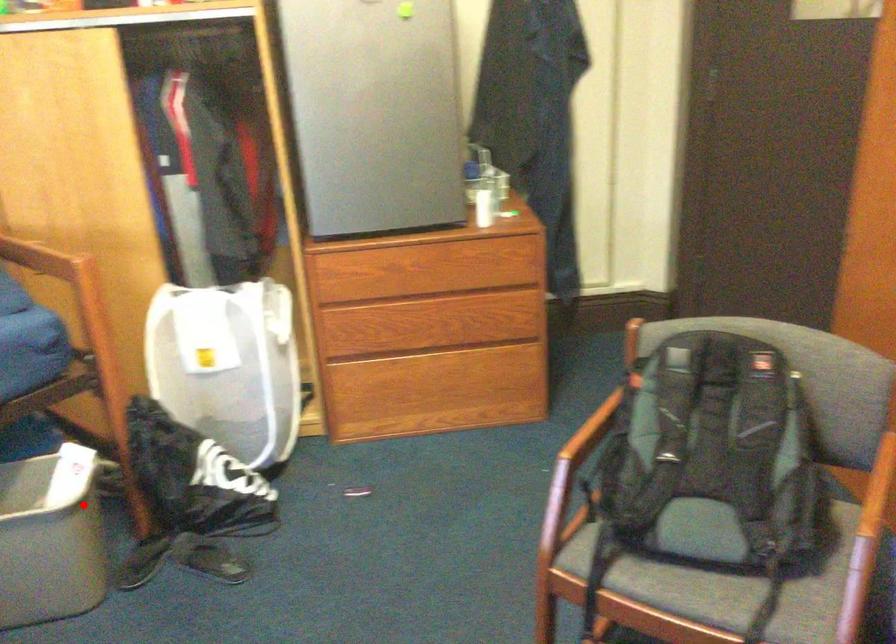
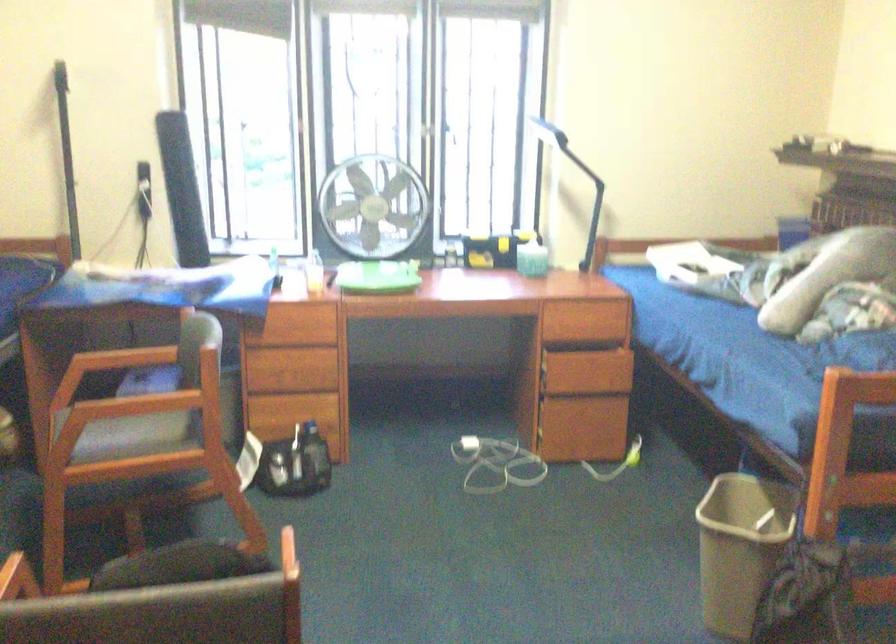
The point at the highlighted location is marked in the first image. Where is the corresponding point in the second image?

(741, 547)